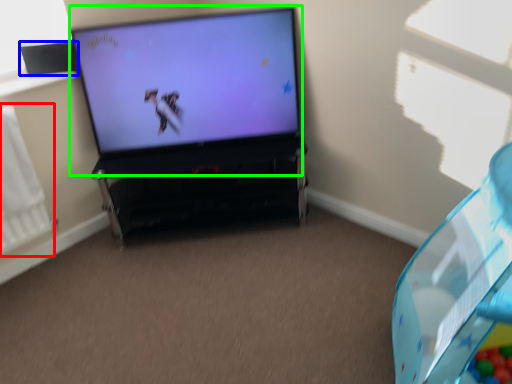
Question: Which is farther away from radiator (highlighted by a red box)? speaker (highlighted by a blue box) or television (highlighted by a green box)?

Choices:
 (A) speaker
 (B) television

Answer: (B)